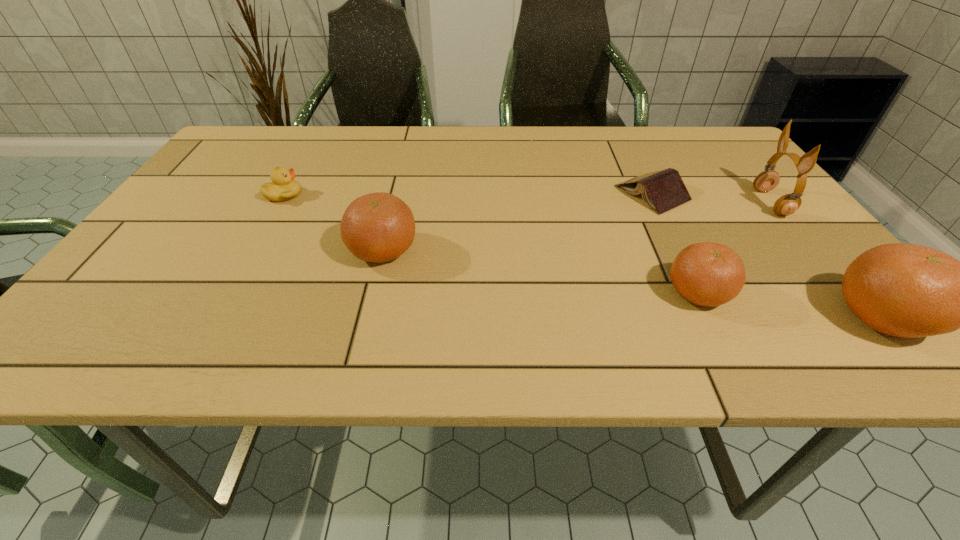
Where is `vacant space that satisfies the following two spatial constraints: 1. on the back side of the leftmost clementine; 2. on the beak of the second shortest object`? This screenshot has height=540, width=960. vacant space that satisfies the following two spatial constraints: 1. on the back side of the leftmost clementine; 2. on the beak of the second shortest object is located at coordinates (396, 194).